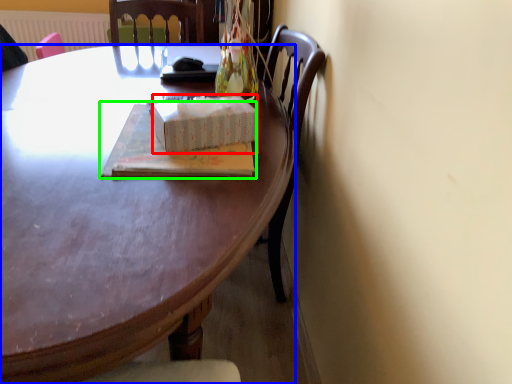
Question: Which is nearer to the box (highlighted by a red box)? desk (highlighted by a blue box) or book (highlighted by a green box).

Choices:
 (A) desk
 (B) book

Answer: (B)